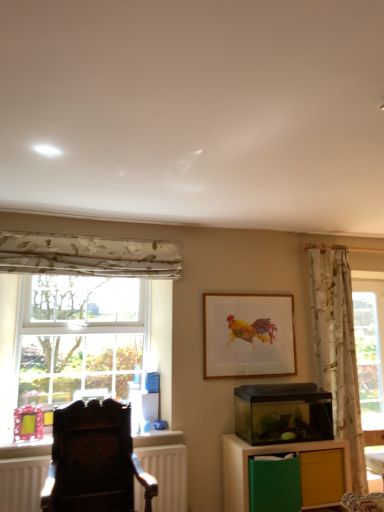
Question: In terms of size, does dark wood chair at left appear bigger or smaller than clear glass window at left?

Choices:
 (A) small
 (B) big

Answer: (B)

Question: Is dark wood chair at left to the left or to the right of clear glass window at left in the image?

Choices:
 (A) left
 (B) right

Answer: (B)

Question: Considering the real-world distances, which object is farthest from the clear glass window at left?

Choices:
 (A) matte yellow drawer at lower right
 (B) dark wood chair at left
 (C) floral fabric curtain at right, which appears as the second curtain when viewed from the left
 (D) transparent glass aquarium at center-right
 (E) wooden cabinet at lower right

Answer: (C)

Question: Considering the real-world distances, which object is closest to the matte yellow drawer at lower right?

Choices:
 (A) wooden cabinet at lower right
 (B) wooden frame at center
 (C) white matte radiator at lower left
 (D) clear glass window at left
 (E) transparent glass aquarium at center-right

Answer: (A)